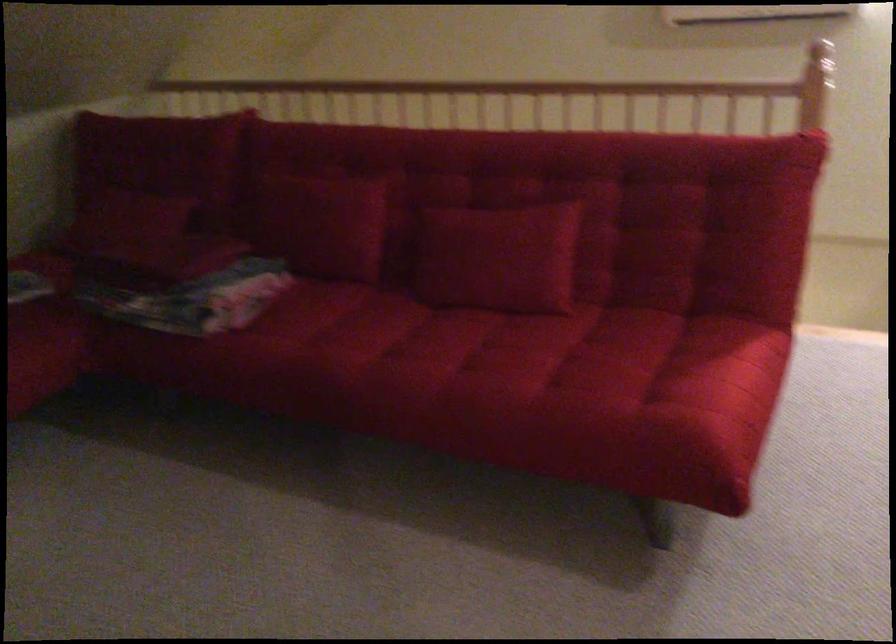
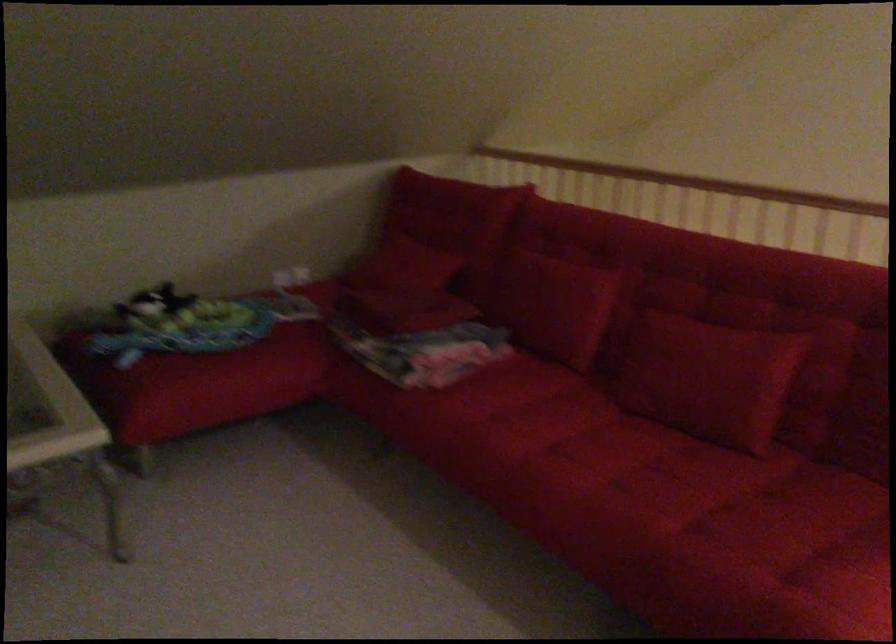
The point at [598,384] is marked in the first image. Where is the corresponding point in the second image?

(754, 558)